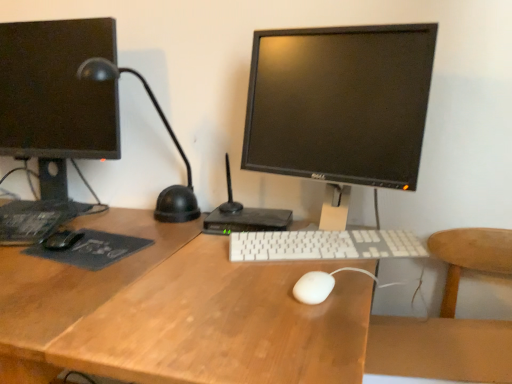
This screenshot has width=512, height=384. In order to click on vacant space that's between black matte mouse at left, which is the 1th mouse in left-to-right order, and white matte mouse at center, the second mouse from the back in this screenshot , I will do `click(199, 266)`.